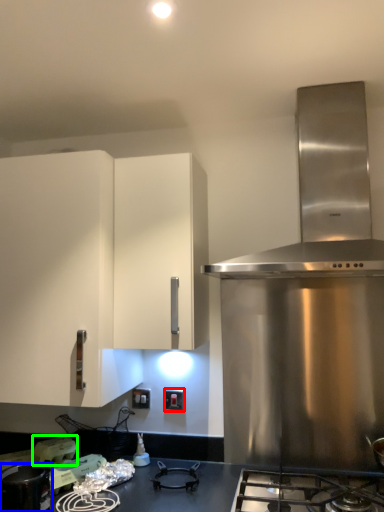
Question: Which is nearer to the electric outlet (highlighted by a red box)? kitchen appliance (highlighted by a blue box) or appliance (highlighted by a green box).

Choices:
 (A) kitchen appliance
 (B) appliance

Answer: (B)